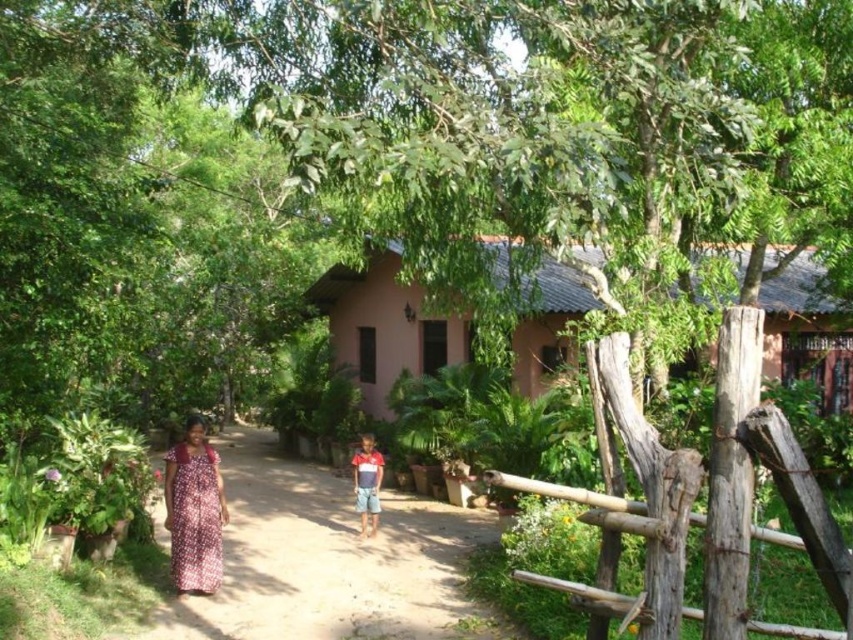
Is pink clay hut at center thinner than printed cotton dress at lower left?

In fact, pink clay hut at center might be wider than printed cotton dress at lower left.

What do you see at coordinates (386, 326) in the screenshot?
I see `pink clay hut at center` at bounding box center [386, 326].

The height and width of the screenshot is (640, 853). I want to click on pink clay hut at center, so click(x=386, y=326).

Is printed cotton dress at lower left positioned before red striped shirt at center?

Yes, printed cotton dress at lower left is closer to the viewer.

The height and width of the screenshot is (640, 853). Describe the element at coordinates (194, 518) in the screenshot. I see `printed cotton dress at lower left` at that location.

Locate an element on the screen. printed cotton dress at lower left is located at coordinates (194, 518).

Between brown dirt path at center and printed cotton dress at lower left, which one has more height?

printed cotton dress at lower left

Is brown dirt path at center positioned behind printed cotton dress at lower left?

That is False.

What do you see at coordinates (329, 561) in the screenshot?
I see `brown dirt path at center` at bounding box center [329, 561].

Image resolution: width=853 pixels, height=640 pixels. Find the location of `brown dirt path at center`. brown dirt path at center is located at coordinates (329, 561).